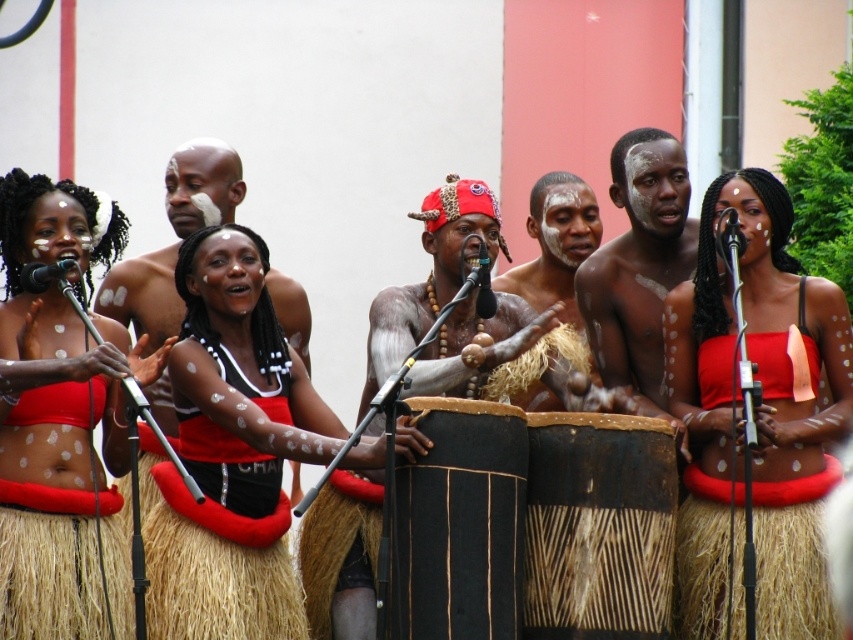
Based on the photo, is matte black dress at center wider than black metallic microphone at upper center?

Indeed, matte black dress at center has a greater width compared to black metallic microphone at upper center.

Can you confirm if matte black dress at center is smaller than black metallic microphone at upper center?

Actually, matte black dress at center might be larger than black metallic microphone at upper center.

Is point (167, 544) positioned before point (732, 257)?

Yes.

This screenshot has height=640, width=853. What are the coordinates of `matte black dress at center` in the screenshot? It's located at (241, 378).

Can you confirm if matte red grass skirt at center is smaller than black metallic microphone at upper center?

No, matte red grass skirt at center is not smaller than black metallic microphone at upper center.

Which is above, matte red grass skirt at center or black metallic microphone at upper center?

Positioned higher is black metallic microphone at upper center.

At what (x,y) coordinates should I click in order to perform the action: click on matte red grass skirt at center. Please return your answer as a coordinate pair (x, y). Image resolution: width=853 pixels, height=640 pixels. Looking at the image, I should click on (61, 420).

Between point (306, 307) and point (550, 244), which one is positioned in front?

Point (306, 307) is in front.

Is matte skin man at center smaller than brown textured skin at center?

Actually, matte skin man at center might be larger than brown textured skin at center.

Locate an element on the screen. The width and height of the screenshot is (853, 640). matte skin man at center is located at coordinates (202, 186).

Where is `matte skin man at center`? This screenshot has width=853, height=640. matte skin man at center is located at coordinates (202, 186).